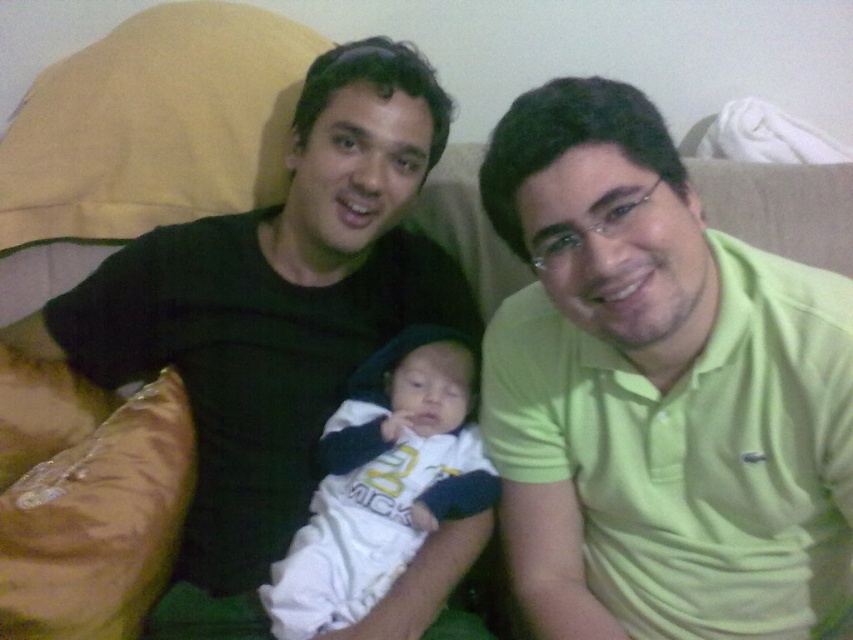
Does white soft fabric baby at center have a greater height compared to brown leather pillow at lower left?

Yes.

Is point (410, 445) more distant than point (167, 499)?

No.

Locate an element on the screen. Image resolution: width=853 pixels, height=640 pixels. white soft fabric baby at center is located at coordinates (383, 483).

Does light green polo shirt at center have a smaller size compared to white soft fabric baby at center?

No.

Which of these two, light green polo shirt at center or white soft fabric baby at center, stands shorter?

white soft fabric baby at center

Which is behind, point (709, 328) or point (456, 468)?

The point (456, 468) is more distant.

Locate an element on the screen. This screenshot has width=853, height=640. light green polo shirt at center is located at coordinates (657, 392).

Does light green polo shirt at center have a smaller size compared to brown leather pillow at lower left?

Actually, light green polo shirt at center might be larger than brown leather pillow at lower left.

Can you confirm if light green polo shirt at center is taller than brown leather pillow at lower left?

Indeed, light green polo shirt at center has a greater height compared to brown leather pillow at lower left.

Where is `light green polo shirt at center`? light green polo shirt at center is located at coordinates (657, 392).

At what (x,y) coordinates should I click in order to perform the action: click on light green polo shirt at center. Please return your answer as a coordinate pair (x, y). This screenshot has height=640, width=853. Looking at the image, I should click on (657, 392).